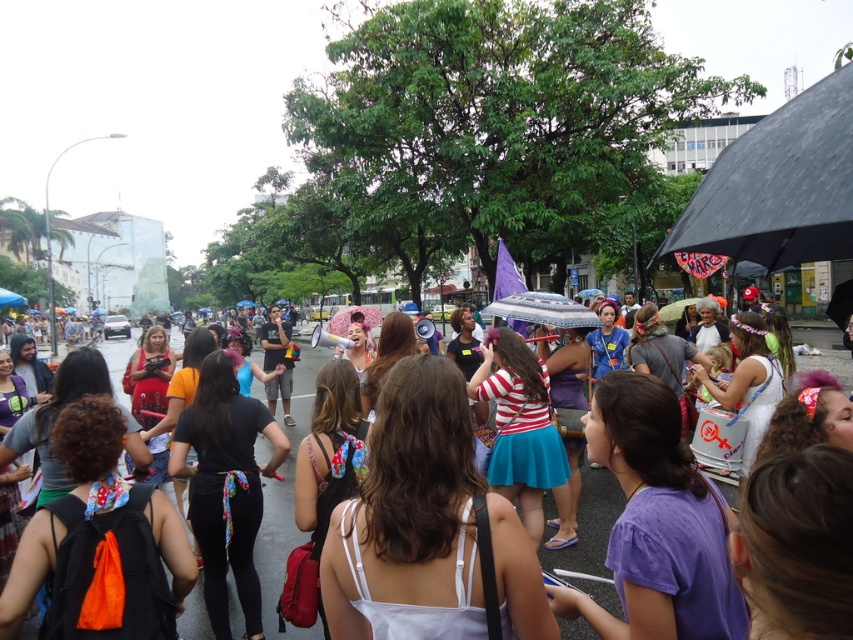
You are standing at the center of the street and looking towards the two points marked in the image. Which point, point [393,556] or point [286,547], is closer to you?

Point [393,556] is closer to the camera than point [286,547], so it is closer to you.

You are a photographer trying to capture the woman in the white fabric dress at center. Where should you position yourself to ensure she is centered in your shot?

To center the white fabric dress at center in your shot, position yourself directly in front of the coordinates point [426,525] where the dress is located.

You are a photographer at the event and want to capture both the white fabric dress at center and the white cotton dress at center in a single frame. Which dress has a narrower silhouette to ensure they both fit comfortably in the shot?

The white fabric dress at center has a narrower silhouette since its width is less than the white cotton dress at center.